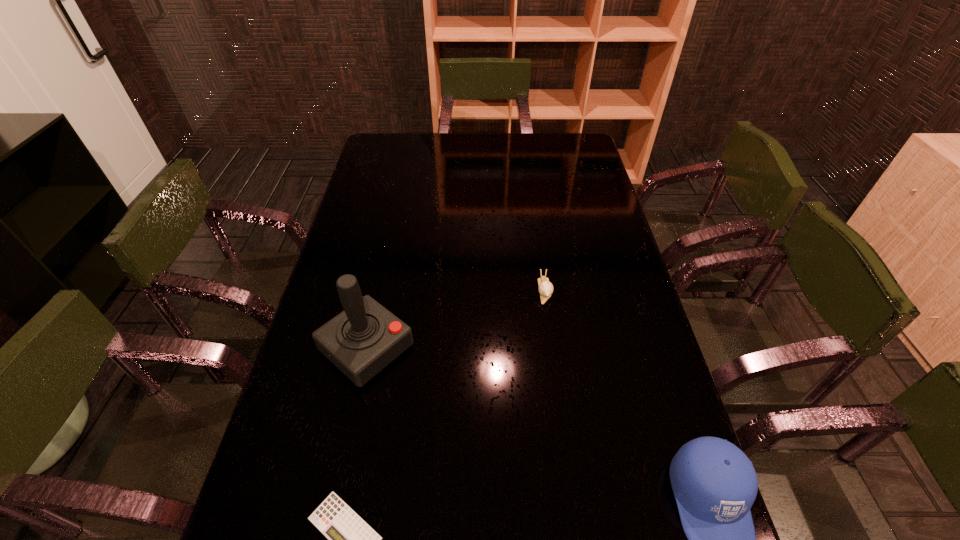
Where is `joystick`? joystick is located at coordinates coord(363,339).

Image resolution: width=960 pixels, height=540 pixels. What are the coordinates of `the second farthest object` in the screenshot? It's located at (363, 339).

Identify the location of escargot. Image resolution: width=960 pixels, height=540 pixels. (545, 288).

This screenshot has width=960, height=540. Find the location of `the farthest object`. the farthest object is located at coordinates (545, 288).

You are a GUI agent. You are given a task and a screenshot of the screen. Output one action in this format:
    pyautogui.click(x=<x>, y=<y>)
    Task: Click on the free space located on the base of the joystick
    Image resolution: width=960 pixels, height=540 pixels.
    Given the screenshot: What is the action you would take?
    pyautogui.click(x=432, y=405)

Identify the location of vacant space located on the base of the joystick. The image size is (960, 540). (490, 455).

Where is `vacant region located on the base of the joystick`? vacant region located on the base of the joystick is located at coordinates (479, 446).

This screenshot has width=960, height=540. In order to click on free location located 0.080m on the shell of the third tallest object in this screenshot , I will do `click(550, 327)`.

This screenshot has height=540, width=960. I want to click on vacant space located 0.240m on the shell of the third tallest object, so click(559, 379).

The height and width of the screenshot is (540, 960). Find the location of `vacant area located on the shell of the third tallest object`. vacant area located on the shell of the third tallest object is located at coordinates (554, 348).